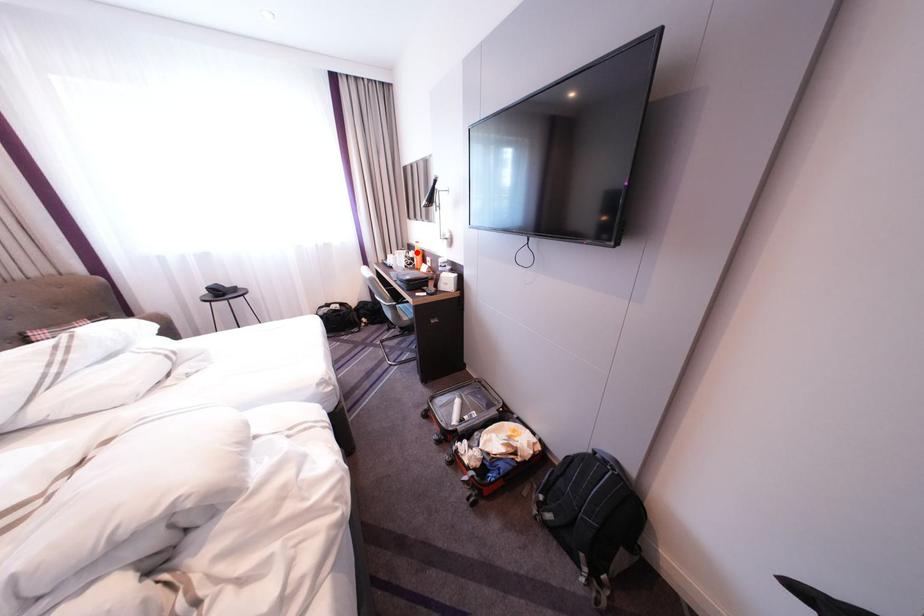
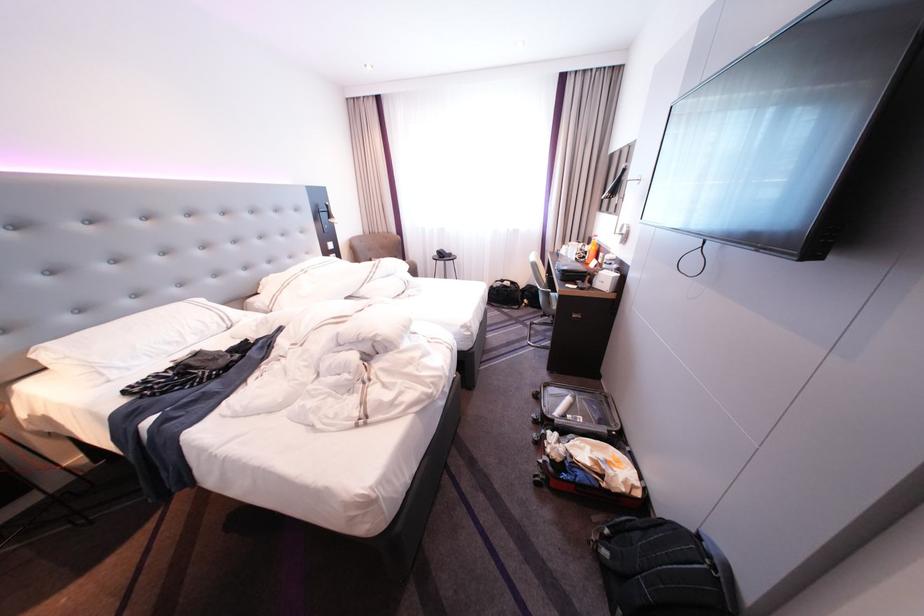
Locate, in the second image, the point that corresponds to the highlighted location in the first image.

(593, 245)